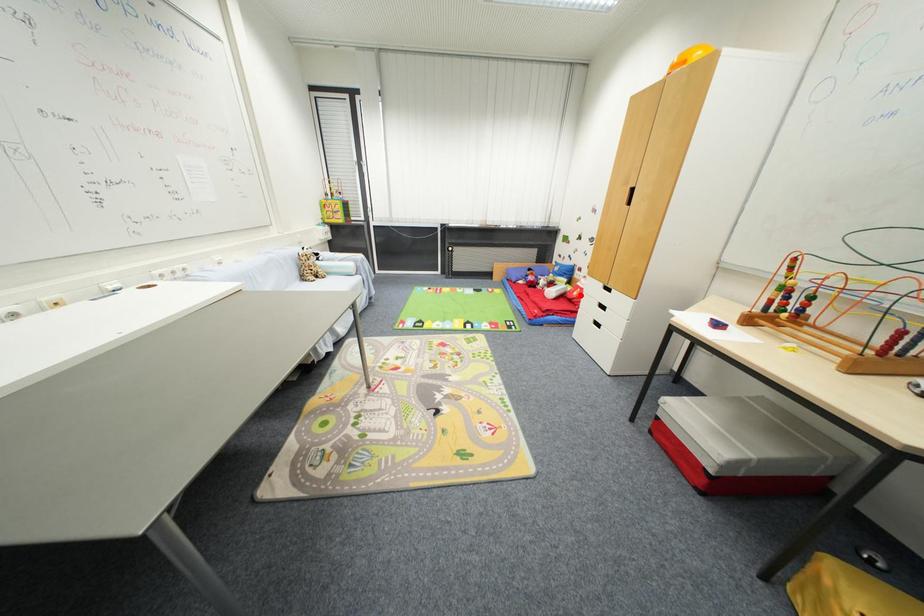
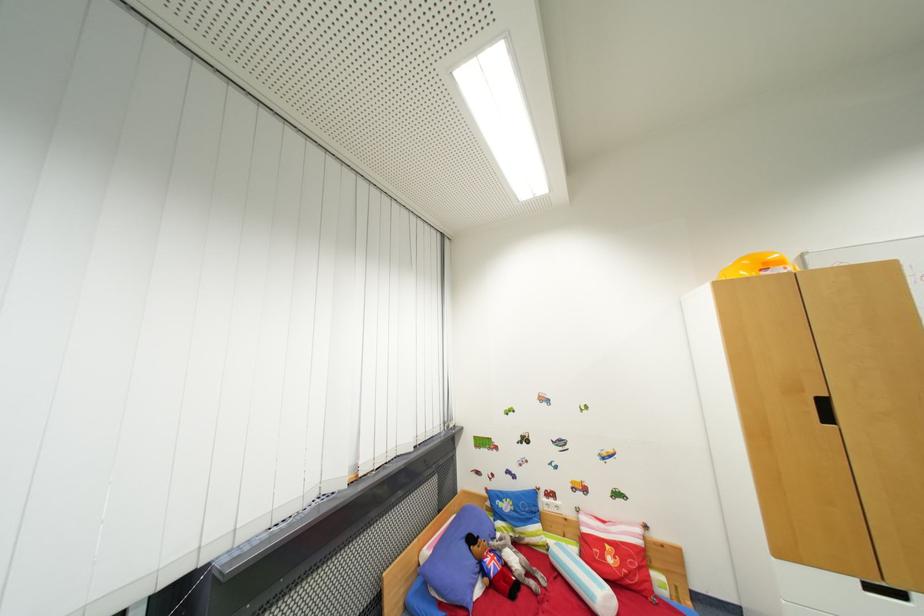
Find the pixel in the second image that matches the highlighted location in the first image.

(614, 562)